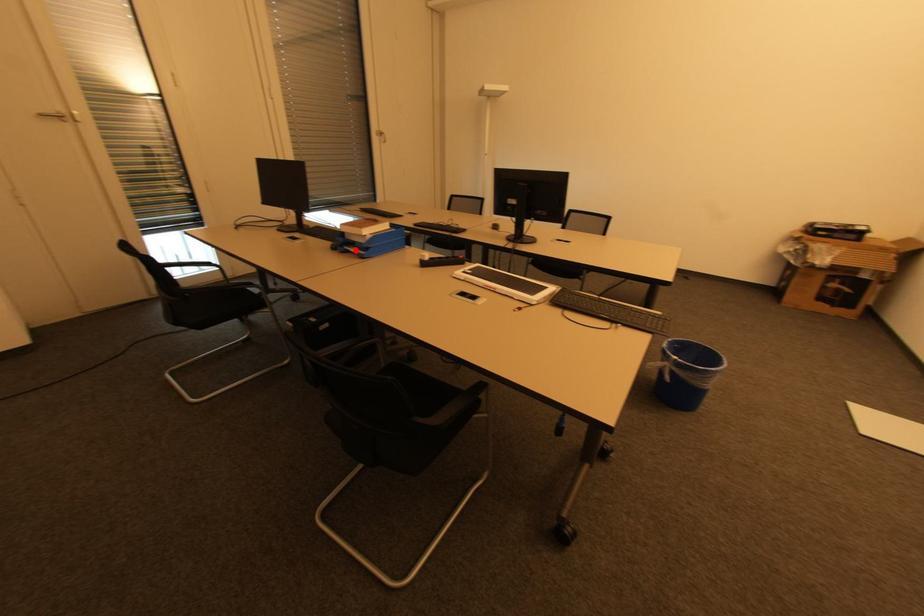
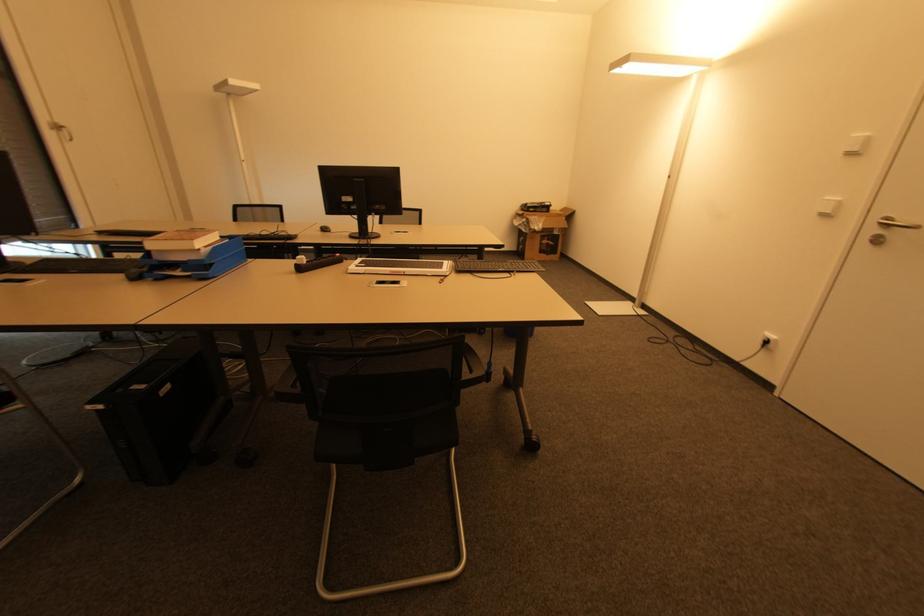
Locate, in the second image, the point that corresponds to the highlighted location in the first image.

(178, 274)